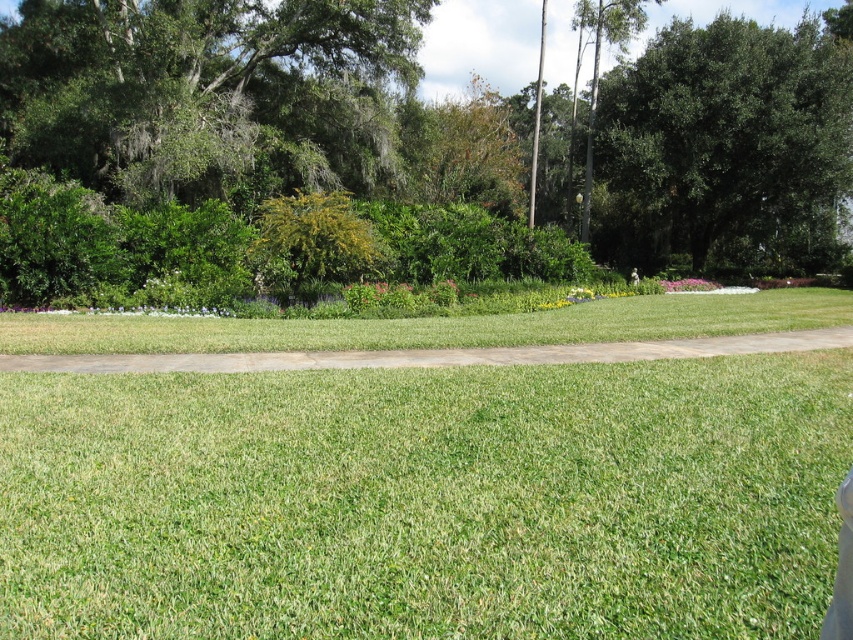
Who is more distant from viewer, (785, 97) or (228, 49)?

Point (228, 49)

Does green leafy tree at upper center have a greater height compared to green leafy tree at upper left?

Yes, green leafy tree at upper center is taller than green leafy tree at upper left.

The image size is (853, 640). Find the location of `green leafy tree at upper center`. green leafy tree at upper center is located at coordinates (407, 147).

Between green leafy tree at upper center and green leafy tree at upper right, which one has less height?

green leafy tree at upper right

Is green leafy tree at upper center in front of green leafy tree at upper right?

Yes, it is in front of green leafy tree at upper right.

At what (x,y) coordinates should I click in order to perform the action: click on green leafy tree at upper center. Please return your answer as a coordinate pair (x, y). Image resolution: width=853 pixels, height=640 pixels. Looking at the image, I should click on (407, 147).

This screenshot has width=853, height=640. I want to click on green leafy tree at upper center, so coord(407,147).

Between point (332, 88) and point (781, 163), which one is positioned behind?

The point (332, 88) is behind.

What do you see at coordinates (207, 92) in the screenshot?
I see `green leafy tree at upper left` at bounding box center [207, 92].

At what (x,y) coordinates should I click in order to perform the action: click on green leafy tree at upper left. Please return your answer as a coordinate pair (x, y). Looking at the image, I should click on (207, 92).